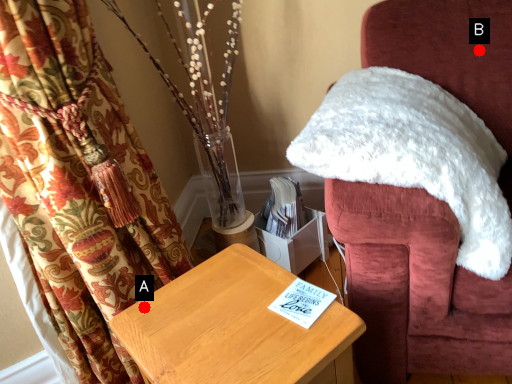
Question: Two points are circled on the image, labeled by A and B beside each circle. Which of the following is the farthest from the observer?

Choices:
 (A) A is further
 (B) B is further

Answer: (B)